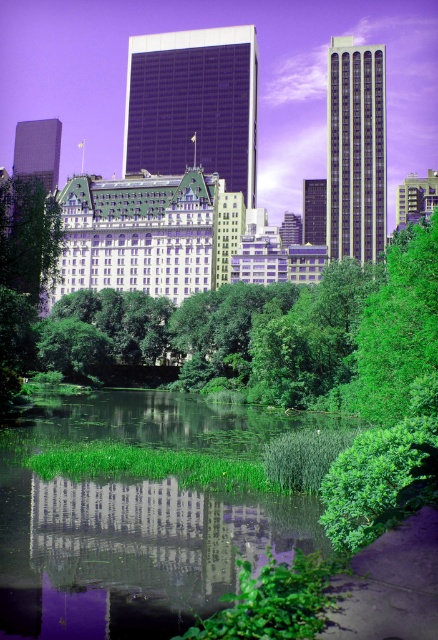
You are an architect analyzing the urban layout. Based on the scene, which building occupies more horizontal space in the image? The purple glass skyscraper at center or the matte green building at upper center?

The purple glass skyscraper at center might be wider than matte green building at upper center according to the description.

You are standing at the point with coordinates (194, 104) in the urban landscape. What object is located exactly at this point?

The purple glass skyscraper at center is located exactly at point (194, 104).